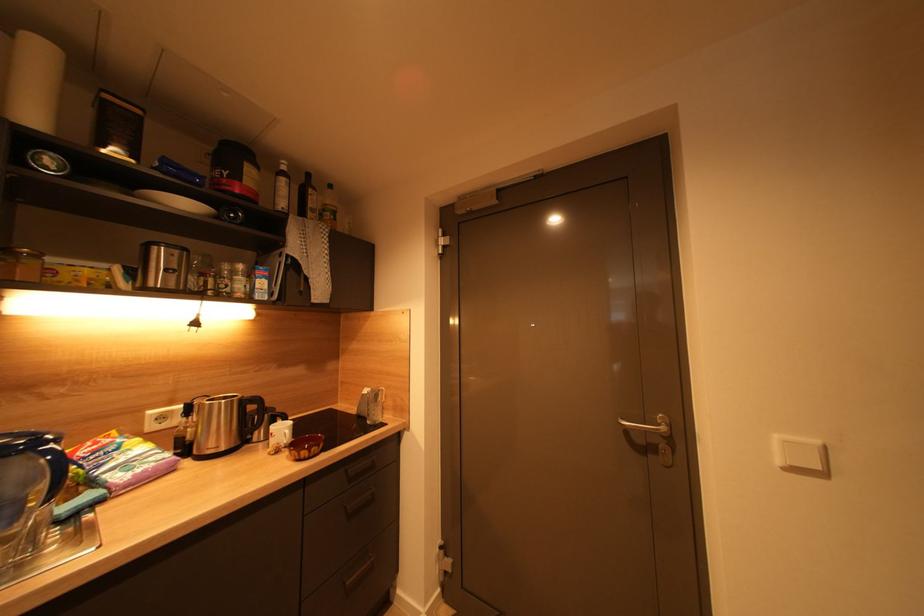
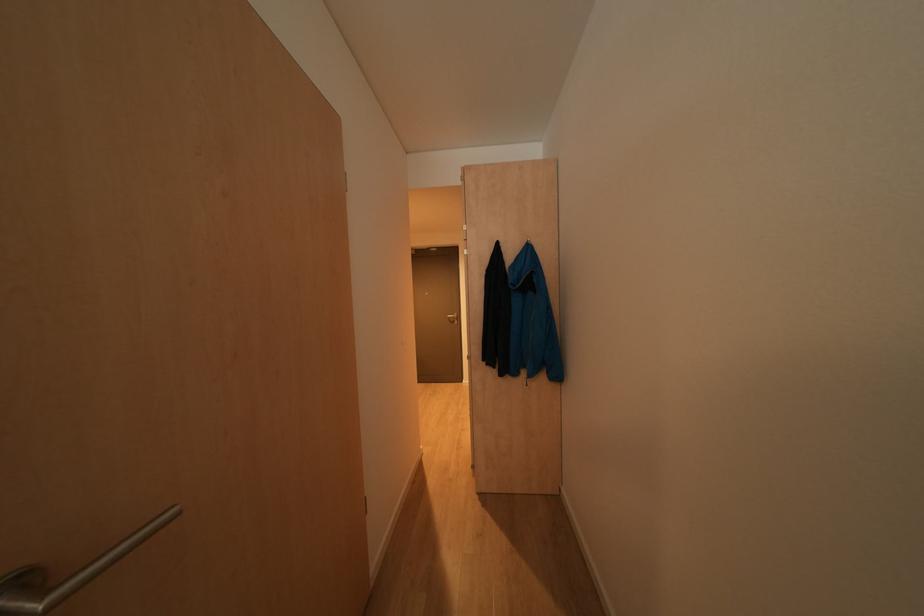
The images are taken continuously from a first-person perspective. In which direction are you moving?

The cameraman moved toward left, backward.